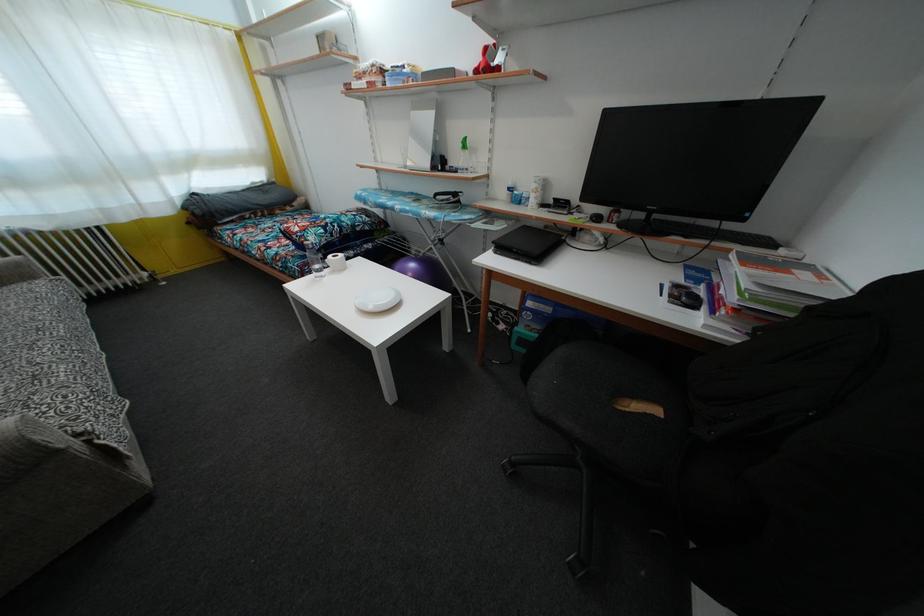
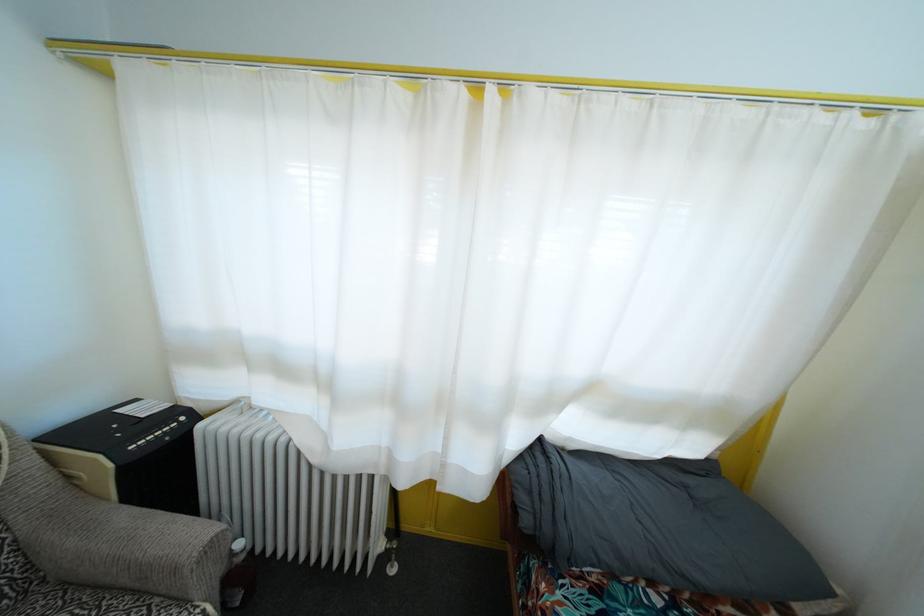
The point at (201, 219) is marked in the first image. Where is the corresponding point in the second image?

(529, 528)